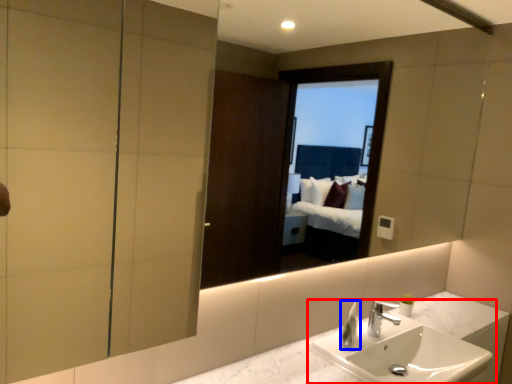
Question: Which point is closer to the camera, sink (highlighted by a red box) or soap dispenser (highlighted by a blue box)?

Choices:
 (A) sink
 (B) soap dispenser

Answer: (A)